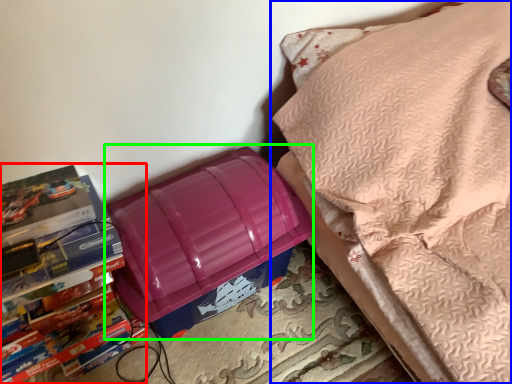
Question: Considering the real-world distances, which object is farthest from book (highlighted by a red box)? furniture (highlighted by a blue box) or lunch box (highlighted by a green box)?

Choices:
 (A) furniture
 (B) lunch box

Answer: (A)